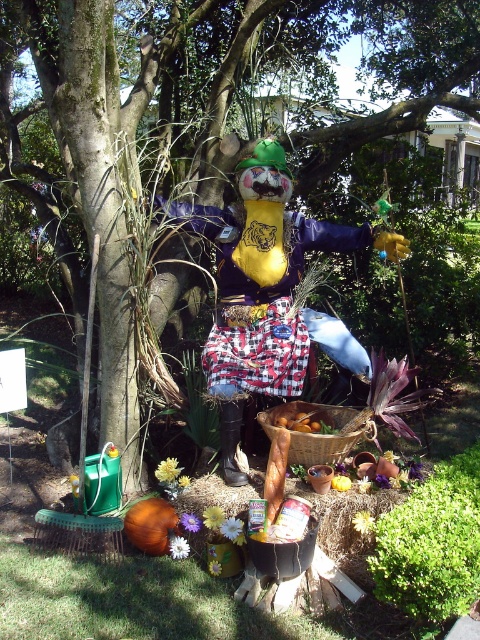
Does point (265, 374) come in front of point (327, 436)?

No, it is behind (327, 436).

Find the location of a particular element. This screenshot has height=640, width=480. matte yellow fabric scarecrow at center is located at coordinates click(272, 282).